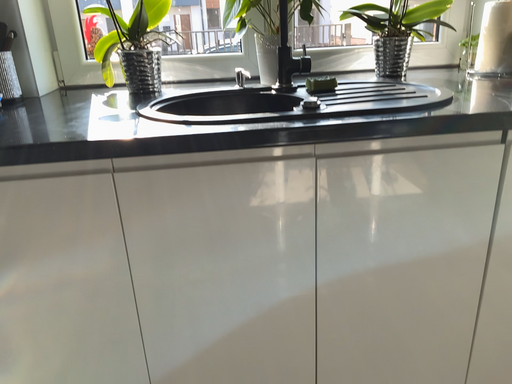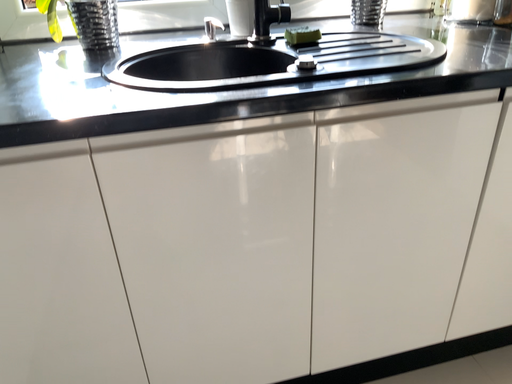
Question: Which way did the camera rotate in the video?

Choices:
 (A) rotated upward
 (B) rotated downward

Answer: (B)